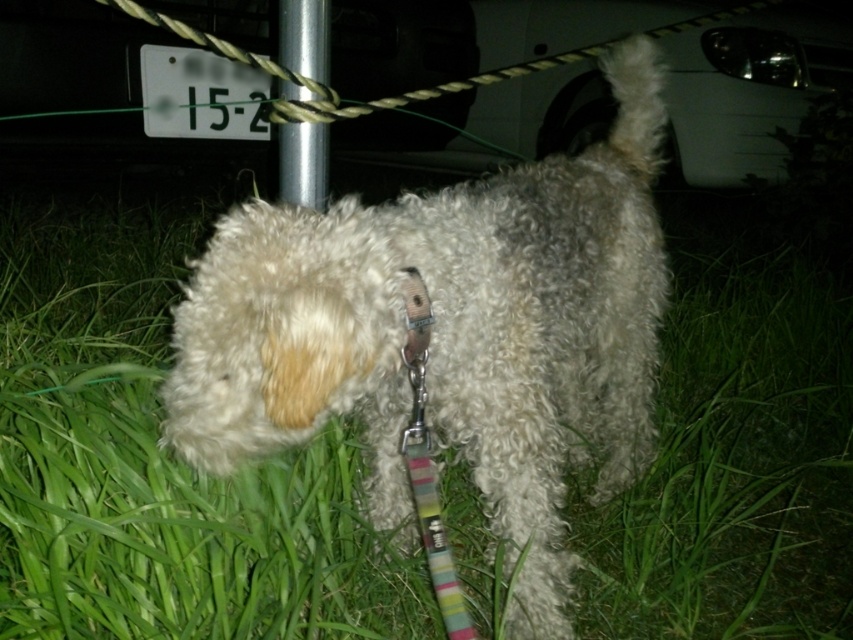
Based on the photo, based on the scene description, where is the fuzzy white dog at center located in terms of coordinates?

The fuzzy white dog at center is located at coordinates point (448, 333).

You are a security guard patrolling a park at night. You see a fuzzy white dog at center and a silver metallic pole at center. Which object is bigger in size?

The fuzzy white dog at center is larger in size than the silver metallic pole at center.

You are a delivery person who needs to secure a package against the silver metallic pole at center. The fuzzy white dog at center is blocking your path. Can you move the dog aside to reach the pole?

The fuzzy white dog at center and the silver metallic pole at center are 34.34 inches apart, so you can move the dog aside to reach the pole since there is enough space between them.